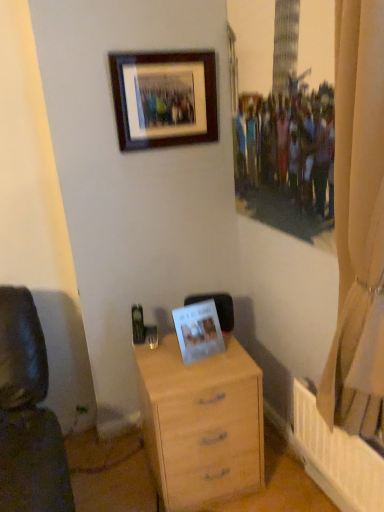
Question: In which direction should I rotate to look at white paper photo frame at center, acting as the 1th picture frame starting from the bottom?

Choices:
 (A) left
 (B) right

Answer: (B)

Question: Is wooden frame at upper center, the first picture frame when ordered from top to bottom, turned away from beige fabric curtain at right?

Choices:
 (A) yes
 (B) no

Answer: (B)

Question: Are wooden frame at upper center, arranged as the second picture frame when ordered from the bottom, and beige fabric curtain at right located far from each other?

Choices:
 (A) no
 (B) yes

Answer: (A)

Question: Is wooden frame at upper center, the first picture frame when ordered from top to bottom, shorter than beige fabric curtain at right?

Choices:
 (A) yes
 (B) no

Answer: (A)

Question: Is wooden frame at upper center, arranged as the second picture frame when ordered from the bottom, thinner than beige fabric curtain at right?

Choices:
 (A) yes
 (B) no

Answer: (A)

Question: From the image's perspective, does wooden frame at upper center, arranged as the second picture frame when ordered from the bottom, appear higher than beige fabric curtain at right?

Choices:
 (A) yes
 (B) no

Answer: (A)

Question: Can you confirm if wooden frame at upper center, arranged as the second picture frame when ordered from the bottom, is taller than beige fabric curtain at right?

Choices:
 (A) no
 (B) yes

Answer: (A)

Question: Would you say light wood chest of drawers at center is part of white paper photo frame at center, marked as the second picture frame in a top-to-bottom arrangement,'s contents?

Choices:
 (A) yes
 (B) no

Answer: (B)

Question: Are white paper photo frame at center, marked as the second picture frame in a top-to-bottom arrangement, and light wood chest of drawers at center far apart?

Choices:
 (A) yes
 (B) no

Answer: (B)

Question: Considering the relative positions of white paper photo frame at center, acting as the 1th picture frame starting from the bottom, and light wood chest of drawers at center in the image provided, is white paper photo frame at center, acting as the 1th picture frame starting from the bottom, behind light wood chest of drawers at center?

Choices:
 (A) no
 (B) yes

Answer: (B)

Question: Is the depth of white paper photo frame at center, marked as the second picture frame in a top-to-bottom arrangement, less than that of light wood chest of drawers at center?

Choices:
 (A) yes
 (B) no

Answer: (B)

Question: Is white paper photo frame at center, acting as the 1th picture frame starting from the bottom, placed right next to light wood chest of drawers at center?

Choices:
 (A) no
 (B) yes

Answer: (A)

Question: Does white paper photo frame at center, acting as the 1th picture frame starting from the bottom, have a lesser width compared to light wood chest of drawers at center?

Choices:
 (A) yes
 (B) no

Answer: (A)

Question: Is light wood chest of drawers at center smaller than wooden frame at upper center, arranged as the second picture frame when ordered from the bottom?

Choices:
 (A) yes
 (B) no

Answer: (B)